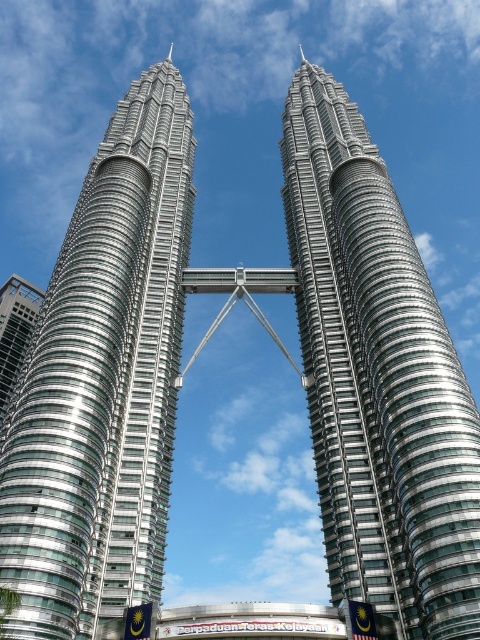
Question: Which point is closer to the camera?

Choices:
 (A) silver glass skyscraper at center
 (B) glassy steel skyscraper at left

Answer: (A)

Question: Which of the following is the farthest from the observer?

Choices:
 (A) silver metallic twin towers at left
 (B) glassy steel skyscraper at left

Answer: (B)

Question: Is silver glass skyscraper at center to the left of glassy steel skyscraper at left from the viewer's perspective?

Choices:
 (A) yes
 (B) no

Answer: (B)

Question: Among these points, which one is nearest to the camera?

Choices:
 (A) (462, 404)
 (B) (117, 502)

Answer: (A)

Question: Does silver metallic twin towers at left appear over silver glass skyscraper at center?

Choices:
 (A) yes
 (B) no

Answer: (A)

Question: In this image, where is silver metallic twin towers at left located relative to glassy steel skyscraper at left?

Choices:
 (A) below
 (B) above

Answer: (B)